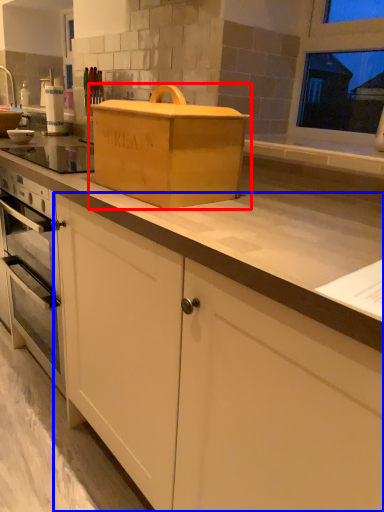
Question: Among these objects, which one is nearest to the camera, cardboard box (highlighted by a red box) or cabinetry (highlighted by a blue box)?

Choices:
 (A) cardboard box
 (B) cabinetry

Answer: (A)